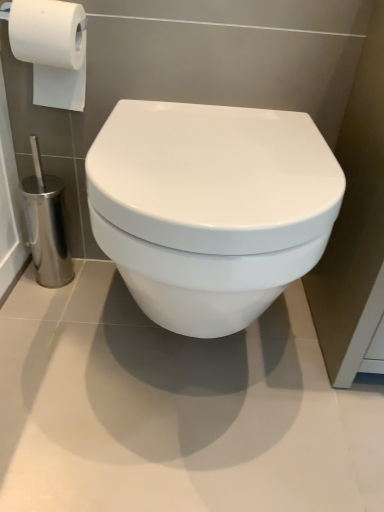
Describe the element at coordinates (51, 49) in the screenshot. I see `white matte toilet paper at upper left` at that location.

Locate an element on the screen. The image size is (384, 512). white matte toilet paper at upper left is located at coordinates (51, 49).

Image resolution: width=384 pixels, height=512 pixels. What do you see at coordinates (210, 208) in the screenshot?
I see `white glossy toilet at center` at bounding box center [210, 208].

The width and height of the screenshot is (384, 512). I want to click on white glossy toilet at center, so click(x=210, y=208).

Locate an element on the screen. The image size is (384, 512). white matte toilet paper at upper left is located at coordinates (51, 49).

Is white glossy toilet at center at the left side of white matte toilet paper at upper left?

Incorrect, white glossy toilet at center is not on the left side of white matte toilet paper at upper left.

In the image, is white glossy toilet at center positioned in front of or behind white matte toilet paper at upper left?

In the image, white glossy toilet at center appears in front of white matte toilet paper at upper left.

Between point (199, 200) and point (42, 21), which one is positioned in front?

The point (199, 200) is more forward.

From the image's perspective, is white glossy toilet at center over white matte toilet paper at upper left?

Incorrect, from the image's perspective, white glossy toilet at center is lower than white matte toilet paper at upper left.

From a real-world perspective, is white glossy toilet at center physically above white matte toilet paper at upper left?

No.

Which object is thinner, white glossy toilet at center or white matte toilet paper at upper left?

With smaller width is white matte toilet paper at upper left.

Is white glossy toilet at center taller or shorter than white matte toilet paper at upper left?

In the image, white glossy toilet at center appears to be taller than white matte toilet paper at upper left.

Does white glossy toilet at center have a larger size compared to white matte toilet paper at upper left?

Correct, white glossy toilet at center is larger in size than white matte toilet paper at upper left.

Is white matte toilet paper at upper left a part of white glossy toilet at center?

No, white matte toilet paper at upper left is not surrounded by white glossy toilet at center.

Is white glossy toilet at center placed right next to white matte toilet paper at upper left?

No, white glossy toilet at center is not making contact with white matte toilet paper at upper left.

Is white matte toilet paper at upper left at the back of white glossy toilet at center?

No, white glossy toilet at center's orientation is not away from white matte toilet paper at upper left.

What's the angular difference between white glossy toilet at center and white matte toilet paper at upper left's facing directions?

0.104 degrees separate the facing orientations of white glossy toilet at center and white matte toilet paper at upper left.

The width and height of the screenshot is (384, 512). Identify the location of toilet on the right of white matte toilet paper at upper left. (210, 208).

Considering the positions of objects white matte toilet paper at upper left and white glossy toilet at center in the image provided, who is more to the left, white matte toilet paper at upper left or white glossy toilet at center?

Positioned to the left is white matte toilet paper at upper left.

In the image, is white matte toilet paper at upper left positioned in front of or behind white glossy toilet at center?

Visually, white matte toilet paper at upper left is located behind white glossy toilet at center.

Between point (34, 25) and point (212, 308), which one is positioned behind?

The point (34, 25) is farther.

From the image's perspective, is white matte toilet paper at upper left below white glossy toilet at center?

Result: No.

From a real-world perspective, which is physically below, white matte toilet paper at upper left or white glossy toilet at center?

white glossy toilet at center.

Consider the image. Considering the relative sizes of white matte toilet paper at upper left and white glossy toilet at center in the image provided, is white matte toilet paper at upper left wider than white glossy toilet at center?

In fact, white matte toilet paper at upper left might be narrower than white glossy toilet at center.

Which of these two, white matte toilet paper at upper left or white glossy toilet at center, stands taller?

white glossy toilet at center.

Does white matte toilet paper at upper left have a larger size compared to white glossy toilet at center?

Incorrect, white matte toilet paper at upper left is not larger than white glossy toilet at center.

Is white matte toilet paper at upper left inside or outside of white glossy toilet at center?

white matte toilet paper at upper left is located beyond the bounds of white glossy toilet at center.

In the scene shown: Are white matte toilet paper at upper left and white glossy toilet at center making contact?

No, white matte toilet paper at upper left is not next to white glossy toilet at center.

Is white matte toilet paper at upper left oriented away from white glossy toilet at center?

white matte toilet paper at upper left is not turned away from white glossy toilet at center.

From the picture: How far apart are white matte toilet paper at upper left and white glossy toilet at center?

38.85 centimeters.

Locate an element on the screen. toilet that is below the white matte toilet paper at upper left (from the image's perspective) is located at coordinates (210, 208).

Locate an element on the screen. Image resolution: width=384 pixels, height=512 pixels. toilet that appears in front of the white matte toilet paper at upper left is located at coordinates (210, 208).

This screenshot has height=512, width=384. In the image, there is a white matte toilet paper at upper left. Identify the location of toilet below it (from the image's perspective). (210, 208).